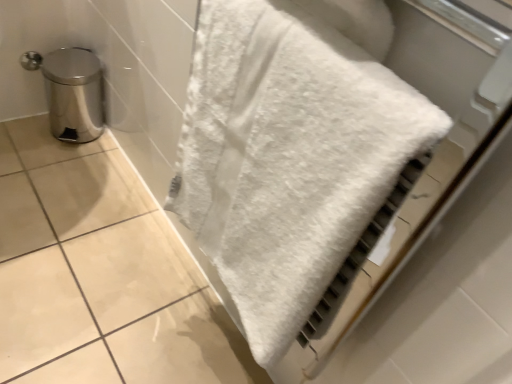
Find the location of `free point below white fluffy towel at center (from a real-world perspective)`. free point below white fluffy towel at center (from a real-world perspective) is located at coordinates (201, 333).